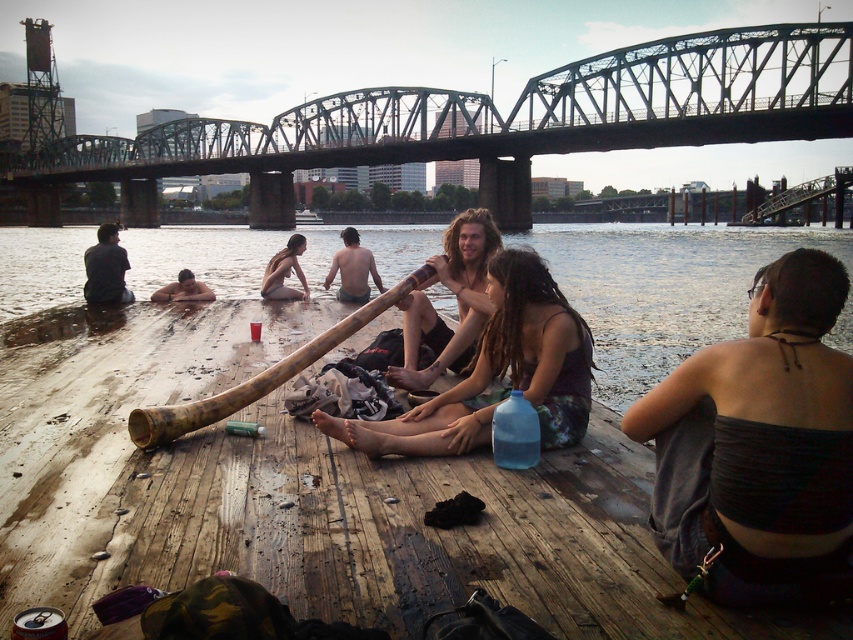
Who is lower down, wooden dock at center or green steel bridge at upper center?

wooden dock at center

Is wooden dock at center wider than green steel bridge at upper center?

No, wooden dock at center is not wider than green steel bridge at upper center.

Between point (381, 616) and point (598, 116), which one is positioned behind?

The point (598, 116) is behind.

Find the location of `wooden dock at center`. wooden dock at center is located at coordinates (306, 493).

Between dark blue shirt at left and light skin tone wood at center, which one has less height?

light skin tone wood at center is shorter.

Can you confirm if dark blue shirt at left is positioned to the left of light skin tone wood at center?

Indeed, dark blue shirt at left is positioned on the left side of light skin tone wood at center.

Does point (90, 268) lie behind point (340, 259)?

That is False.

You are a GUI agent. You are given a task and a screenshot of the screen. Output one action in this format:
    pyautogui.click(x=<x>, y=<y>)
    Task: Click on the dark blue shirt at left
    This screenshot has height=640, width=853.
    Given the screenshot: What is the action you would take?
    pyautogui.click(x=106, y=268)

Does green steel bridge at upper center appear on the left side of brown wooden dock at lower center?

Yes, green steel bridge at upper center is to the left of brown wooden dock at lower center.

Is the position of green steel bridge at upper center more distant than that of brown wooden dock at lower center?

Yes, it is.

Which is behind, point (677, 141) or point (646, 243)?

Positioned behind is point (677, 141).

Identify the location of green steel bridge at upper center. (486, 122).